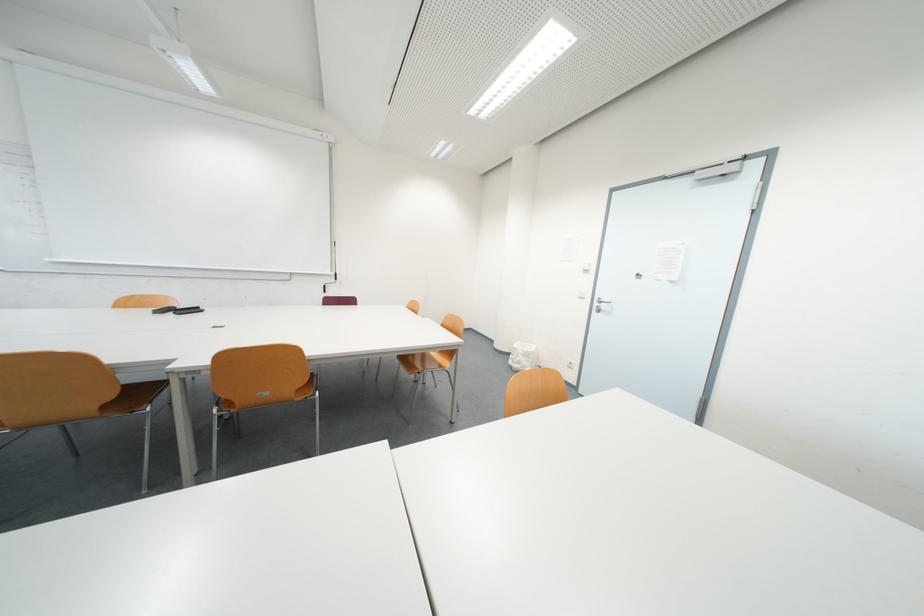
Find where to pull the black screen handle. Please return your answer as a coordinate pair (x, y).

(187, 310)